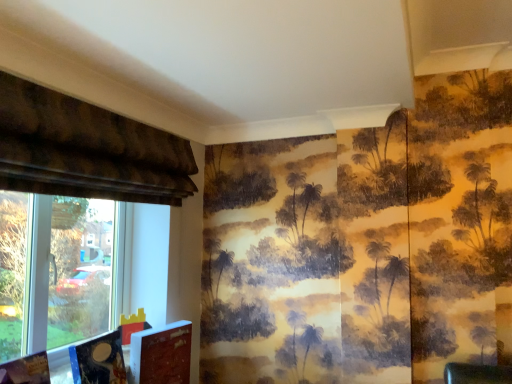
From the picture: What is the approximate height of transparent glass window at left?

It is 29.01 inches.

What is the approximate width of transparent glass window at left?

transparent glass window at left is 2.68 inches wide.

This screenshot has width=512, height=384. Find the location of `transparent glass window at left`. transparent glass window at left is located at coordinates (56, 268).

What do you see at coordinates (56, 268) in the screenshot? I see `transparent glass window at left` at bounding box center [56, 268].

Where is `transparent glass window at left`? This screenshot has height=384, width=512. transparent glass window at left is located at coordinates (56, 268).